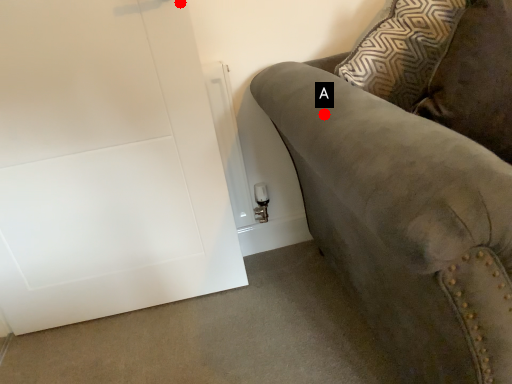
Question: Two points are circled on the image, labeled by A and B beside each circle. Which point appears closest to the camera in this image?

Choices:
 (A) A is closer
 (B) B is closer

Answer: (A)